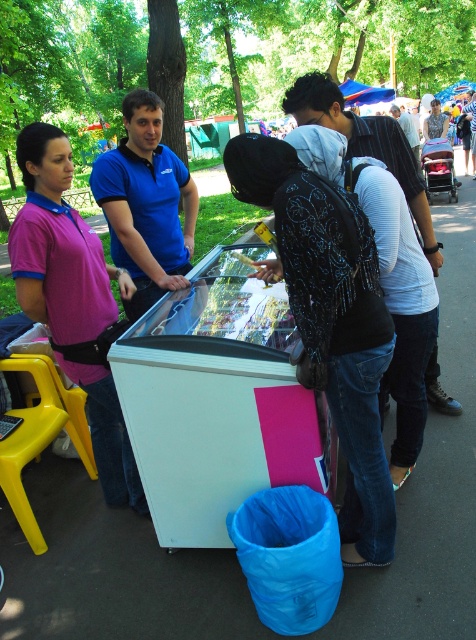
Question: Is the position of blue cotton polo shirt at center more distant than that of white textured backpack at center?

Choices:
 (A) yes
 (B) no

Answer: (A)

Question: Can you confirm if blue cotton polo shirt at center is bigger than white textured backpack at center?

Choices:
 (A) yes
 (B) no

Answer: (A)

Question: Is blue cotton polo shirt at center to the left of white textured backpack at center from the viewer's perspective?

Choices:
 (A) no
 (B) yes

Answer: (B)

Question: Which of the following is the closest to the observer?

Choices:
 (A) blue cotton polo shirt at center
 (B) white textured backpack at center

Answer: (B)

Question: Among these objects, which one is farthest from the camera?

Choices:
 (A) white textured backpack at center
 (B) blue cotton polo shirt at center

Answer: (B)